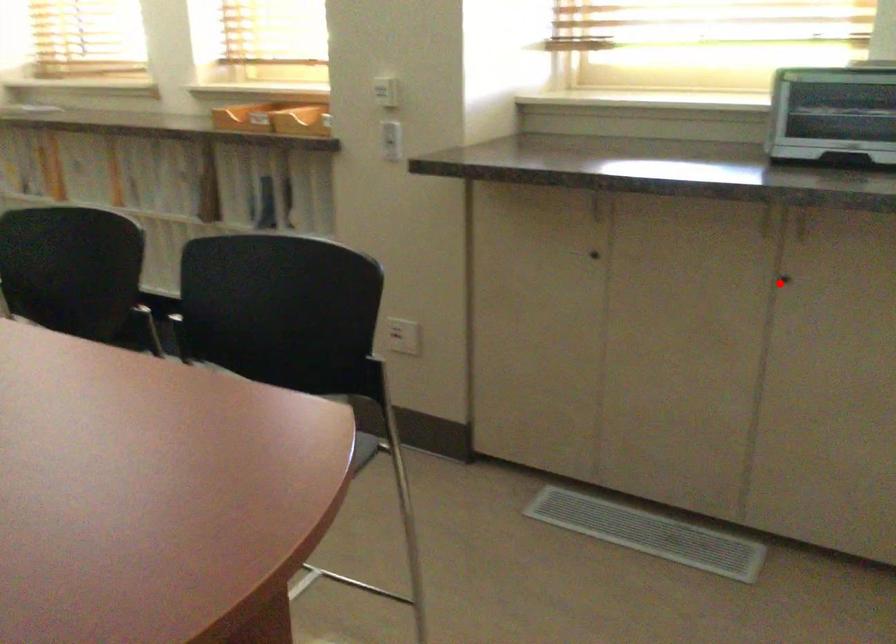
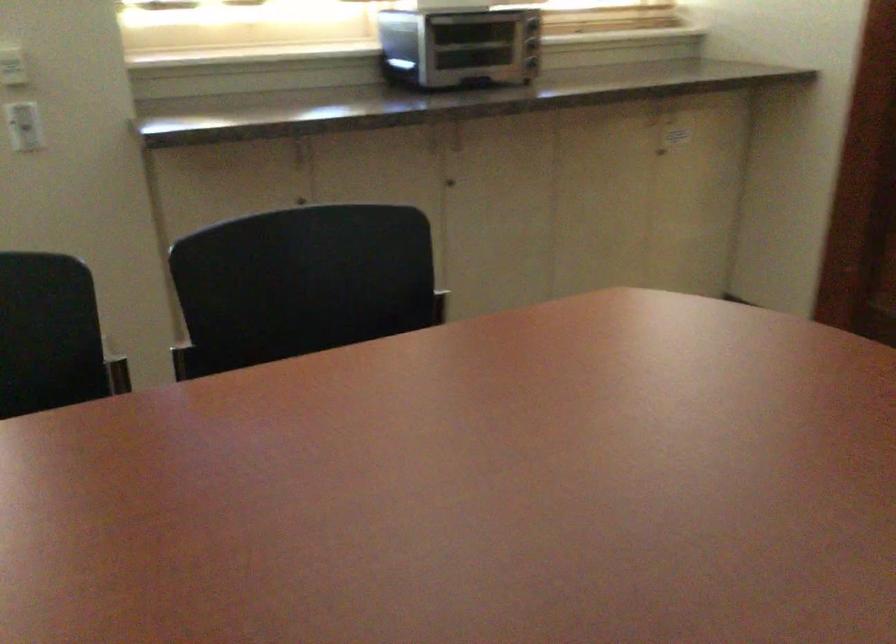
Question: I am providing you with two images of the same scene from different viewpoints. In image1, a red point is highlighted. Considering the same 3D point in image2, which of the following is correct?

Choices:
 (A) It is closer
 (B) It is farther

Answer: (B)